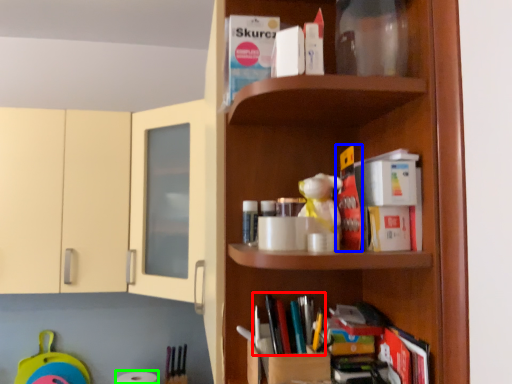
Question: Considering the real-world distances, which object is closest to book (highlighted by a red box)? book (highlighted by a blue box) or toilet paper (highlighted by a green box).

Choices:
 (A) book
 (B) toilet paper

Answer: (A)